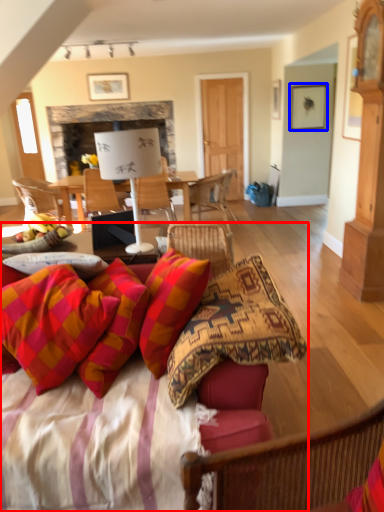
Question: Which object is further to the camera taking this photo, studio couch (highlighted by a red box) or picture frame (highlighted by a blue box)?

Choices:
 (A) studio couch
 (B) picture frame

Answer: (B)